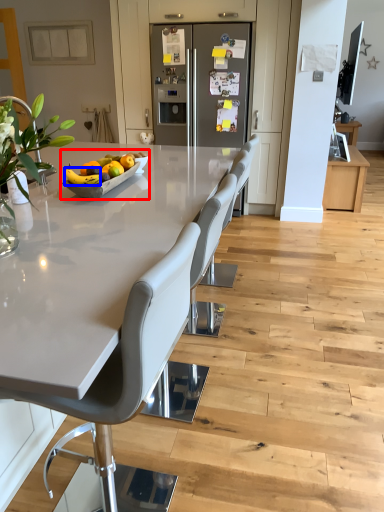
Question: Which of the following is the closest to the observer, fruit dish (highlighted by a red box) or fruit (highlighted by a blue box)?

Choices:
 (A) fruit dish
 (B) fruit

Answer: (B)